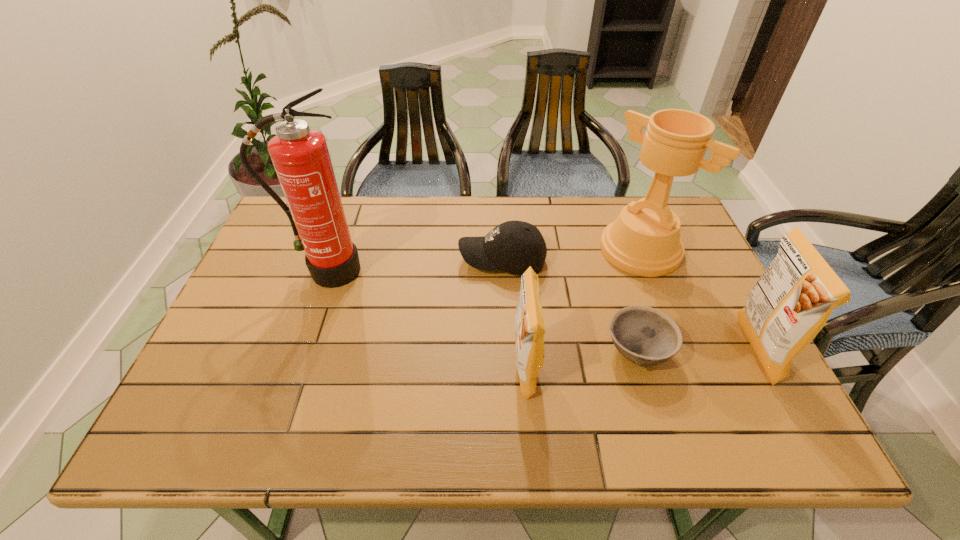
The width and height of the screenshot is (960, 540). In order to click on crisp (potato chip) that is at the right edge in this screenshot , I will do `click(791, 302)`.

The width and height of the screenshot is (960, 540). Find the location of `award that is at the right edge`. award that is at the right edge is located at coordinates (644, 240).

The image size is (960, 540). Find the location of `object that is at the far right corner`. object that is at the far right corner is located at coordinates (644, 240).

This screenshot has width=960, height=540. In order to click on object that is at the near right corner in this screenshot , I will do `click(791, 302)`.

The height and width of the screenshot is (540, 960). What are the coordinates of `free space at the far edge` in the screenshot? It's located at (477, 231).

This screenshot has width=960, height=540. Find the location of `vacant area at the far left corner`. vacant area at the far left corner is located at coordinates (274, 232).

What are the coordinates of `free spot between the second shortest object and the leftmost object` in the screenshot? It's located at (415, 266).

In order to click on empty location between the baseball cap and the taller crisp (potato chip) in this screenshot , I will do [628, 306].

Where is `free space between the shortest object and the fifth tallest object`? The image size is (960, 540). free space between the shortest object and the fifth tallest object is located at coordinates (570, 306).

Find the location of a particular element. empty space that is in between the shortest object and the second shortest object is located at coordinates (570, 306).